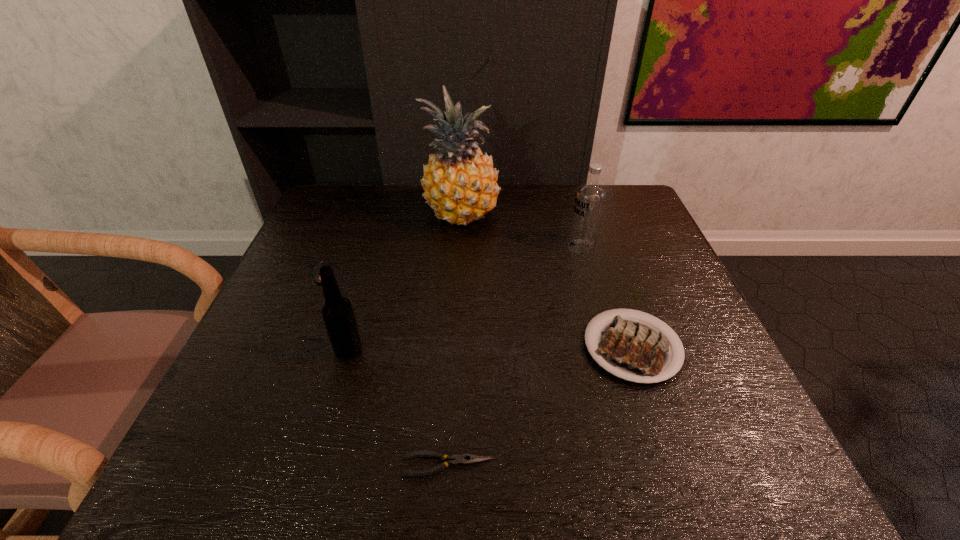
Identify the location of vacant space located on the front label of the vodka. Image resolution: width=960 pixels, height=540 pixels. (481, 247).

I want to click on vacant space located 0.250m on the front label of the vodka, so click(x=469, y=247).

The image size is (960, 540). In order to click on vacant position located 0.240m on the front label of the vodka in this screenshot , I will do `click(473, 247)`.

The width and height of the screenshot is (960, 540). In order to click on free space located on the left of the fifth object from right to left in this screenshot , I will do `click(294, 350)`.

Locate an element on the screen. vacant space situated on the left of the plate is located at coordinates click(433, 347).

Where is `free space located on the back of the leftmost object`? Image resolution: width=960 pixels, height=540 pixels. free space located on the back of the leftmost object is located at coordinates (352, 202).

The width and height of the screenshot is (960, 540). In order to click on free spot located on the back of the shortest object in this screenshot , I will do `click(456, 314)`.

What are the coordinates of `object positioned at the far edge` in the screenshot? It's located at (460, 183).

Image resolution: width=960 pixels, height=540 pixels. Find the location of `object present at the near edge`. object present at the near edge is located at coordinates (462, 459).

You are a GUI agent. You are given a task and a screenshot of the screen. Output one action in this format:
    pyautogui.click(x=<x>, y=<y>)
    Task: Click on the object positioned at the left edge
    
    Given the screenshot: What is the action you would take?
    pyautogui.click(x=316, y=276)